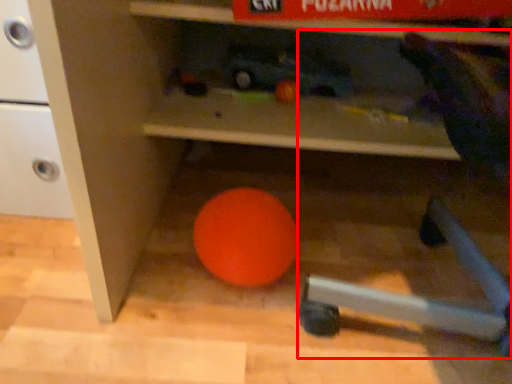
Question: From the image's perspective, where is bean bag chair (annotated by the red box) located in relation to ball in the image?

Choices:
 (A) below
 (B) above

Answer: (B)